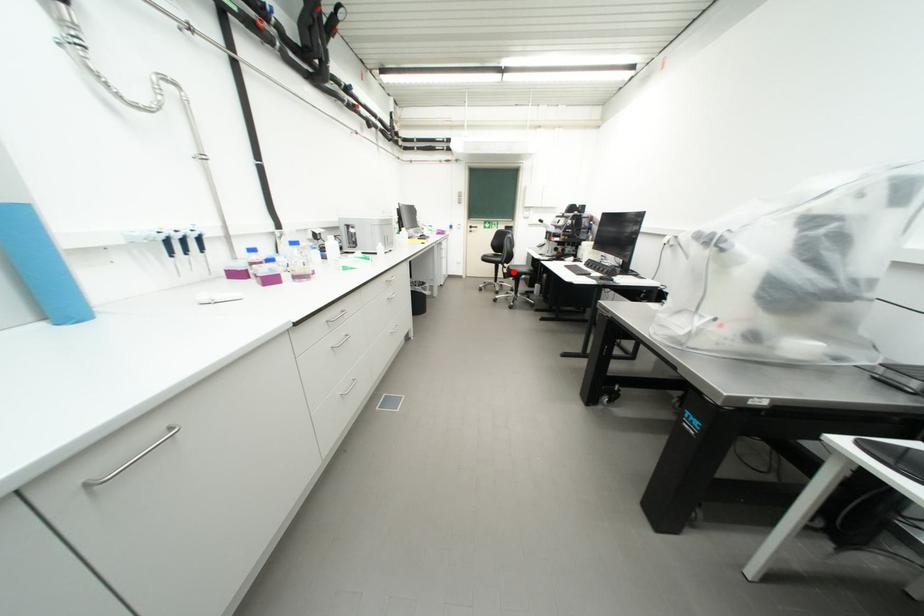
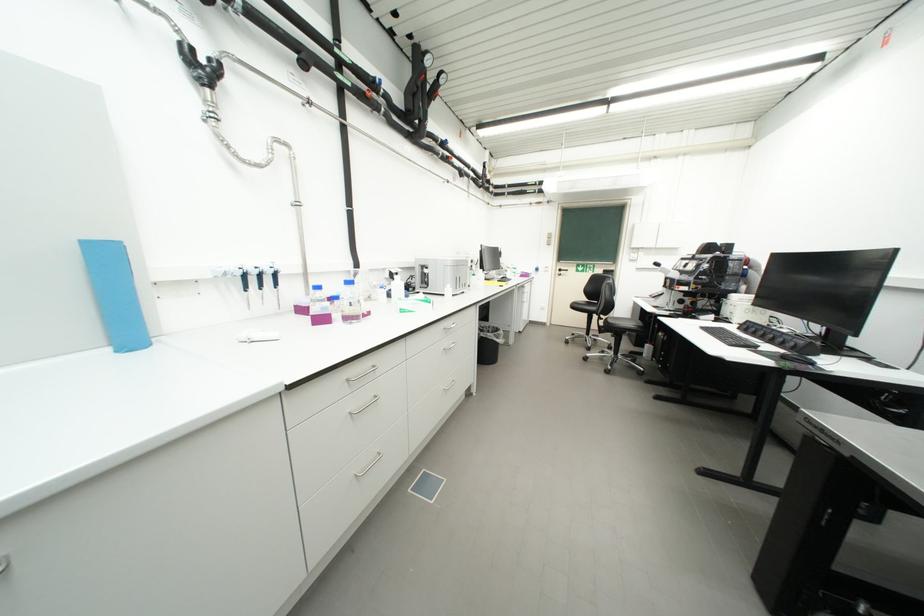
The point at the highlighted location is marked in the first image. Where is the corresponding point in the second image?

(610, 325)